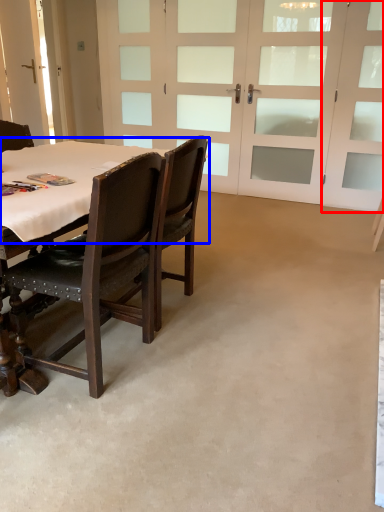
Question: Which object appears farthest to the camera in this image, screen door (highlighted by a red box) or table top (highlighted by a blue box)?

Choices:
 (A) screen door
 (B) table top

Answer: (A)